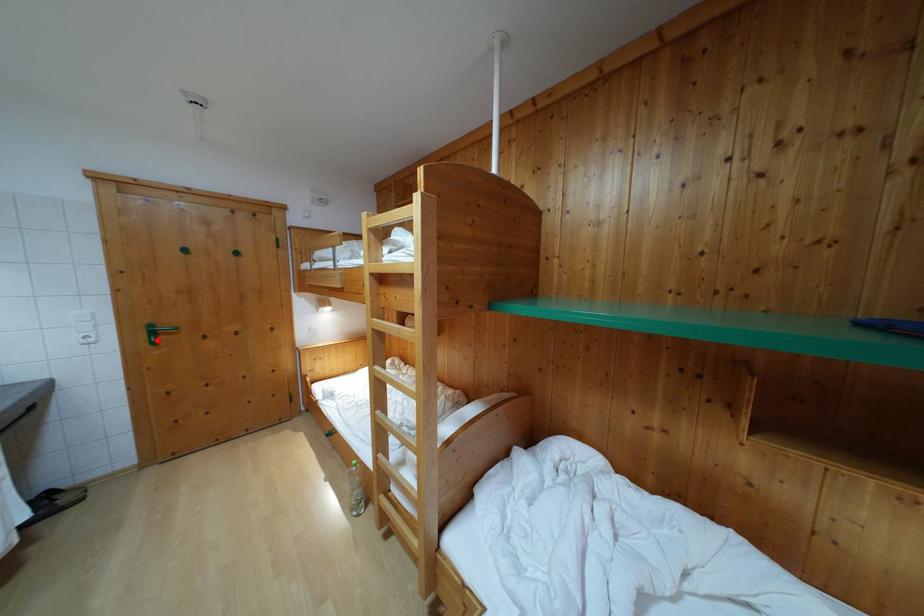
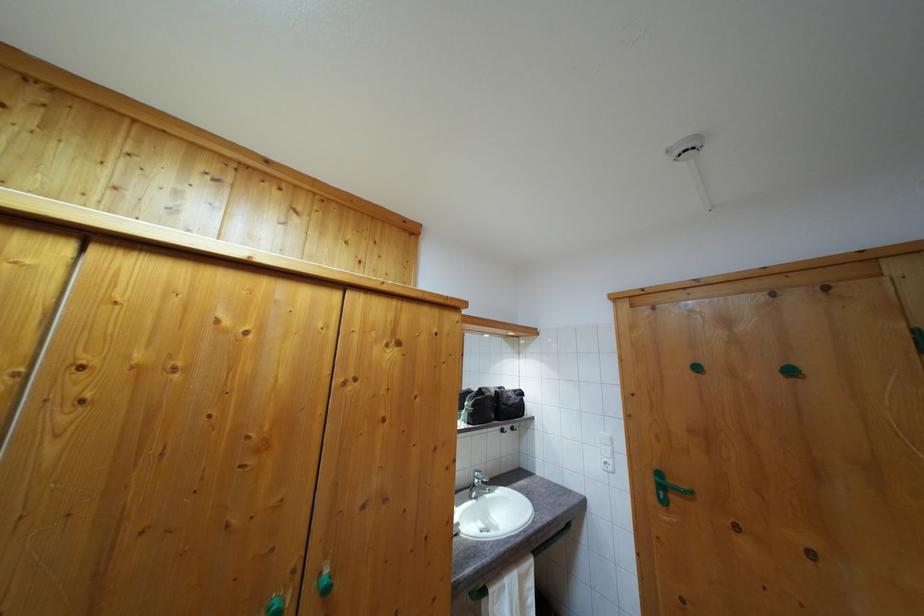
The point at the highlighted location is marked in the first image. Where is the corresponding point in the second image?

(664, 493)